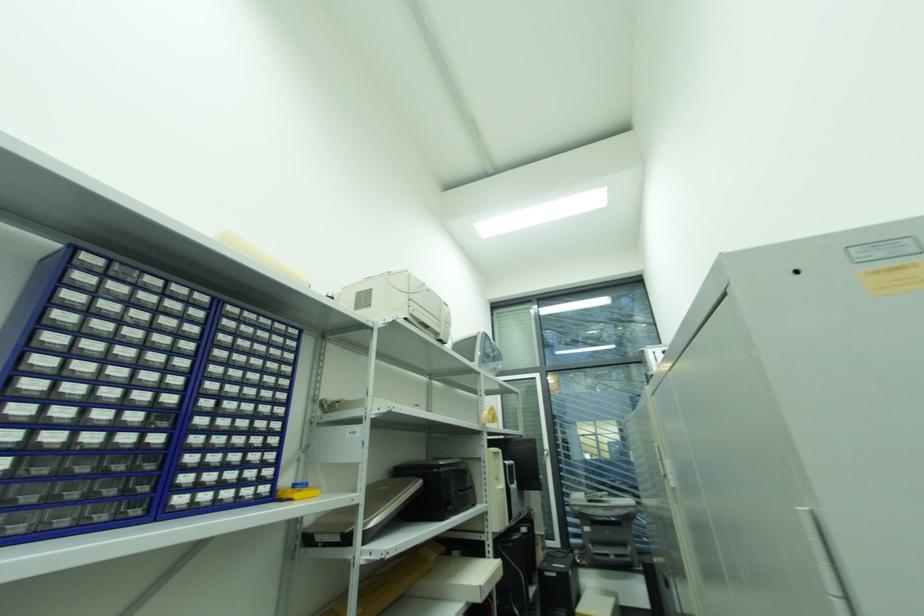
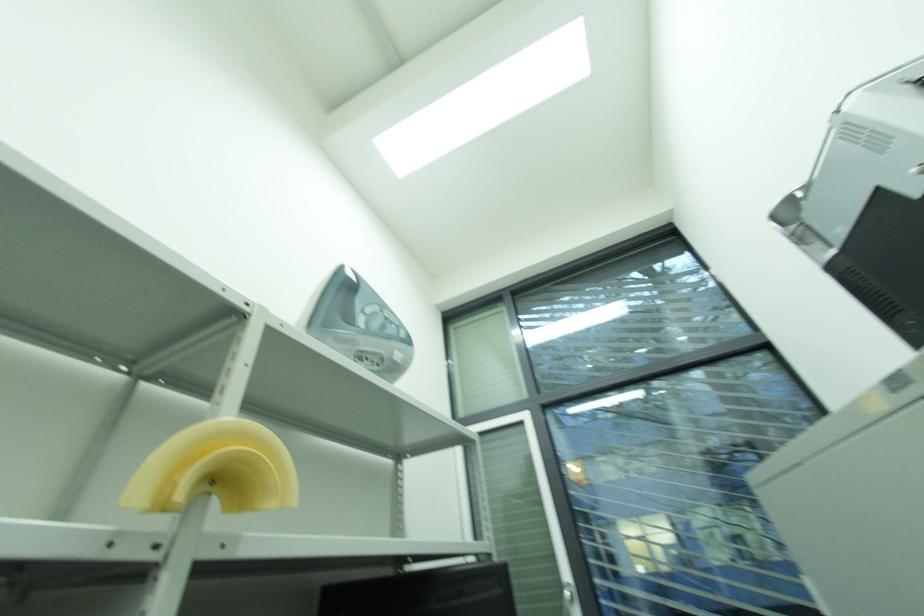
Question: Which direction would the cameraman need to move to produce the second image? Reply with the corresponding letter.

Choices:
 (A) Left
 (B) Right
 (C) Forward
 (D) Backward

Answer: (C)